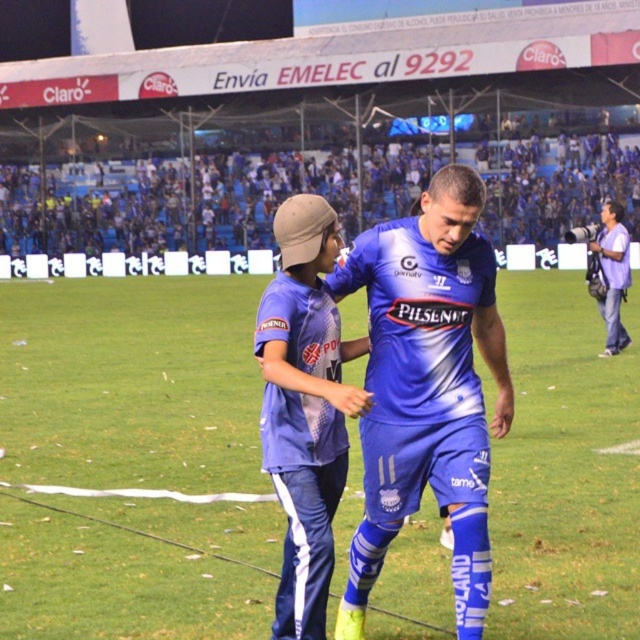
Question: Is blue fabric football field at center smaller than matte blue tracksuit at center?

Choices:
 (A) no
 (B) yes

Answer: (A)

Question: Which point appears farthest from the camera in this image?

Choices:
 (A) (419, 400)
 (B) (621, 332)
 (C) (324, 627)
 (D) (346, 524)

Answer: (B)

Question: Is matte blue tracksuit at center above purple cotton shirt at right?

Choices:
 (A) no
 (B) yes

Answer: (A)

Question: Which point is farther to the camera?

Choices:
 (A) (291, 388)
 (B) (74, 580)
 (C) (609, 234)
 (D) (444, 230)

Answer: (C)

Question: Among these objects, which one is nearest to the camera?

Choices:
 (A) blue jersey at center
 (B) purple cotton shirt at right

Answer: (A)

Question: Can you confirm if blue fabric football field at center is thinner than blue jersey at center?

Choices:
 (A) yes
 (B) no

Answer: (B)